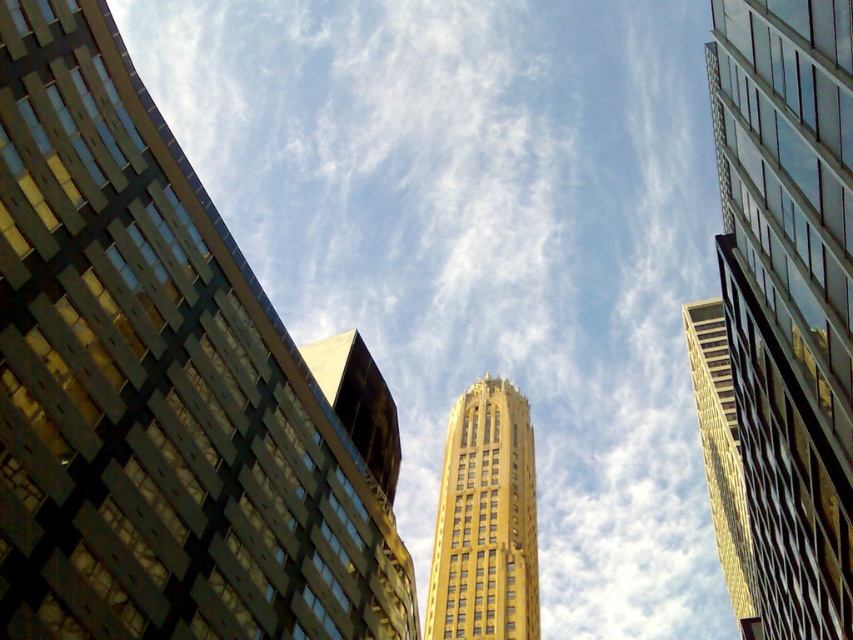
You are standing at the base of the city looking up. There is a gold glass skyscraper at upper center located at point (788, 296). Which direction should you look to see it?

The gold glass skyscraper at upper center is located at point (788, 296), so you should look towards the upper center direction to see it.

You are a drone operator trying to navigate between two buildings in the cityscape. You need to fly your drone from the left building to the right building while avoiding the gold glass skyscraper at upper center. According to the coordinates provided, is the point at [788,296] directly between the two buildings?

The point at [788,296] is where the gold glass skyscraper at upper center is located, so it is not between the two buildings but directly at that position, meaning the drone would need to navigate around it rather than through this point.